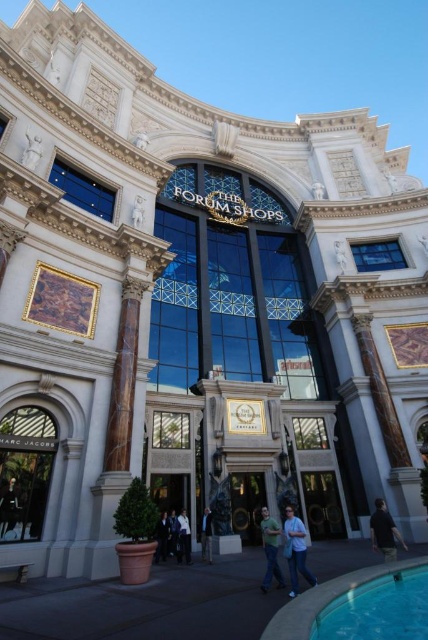
Does light blue denim jacket at center have a lesser height compared to dark blue jacket at center?

Incorrect, light blue denim jacket at center's height does not fall short of dark blue jacket at center's.

Can you confirm if light blue denim jacket at center is positioned below dark blue jacket at center?

Correct, light blue denim jacket at center is located below dark blue jacket at center.

Image resolution: width=428 pixels, height=640 pixels. Describe the element at coordinates (207, 536) in the screenshot. I see `light blue denim jacket at center` at that location.

The width and height of the screenshot is (428, 640). Find the location of `light blue denim jacket at center`. light blue denim jacket at center is located at coordinates (207, 536).

Is point (250, 499) in front of point (169, 516)?

No, it is behind (169, 516).

Between point (249, 476) and point (169, 525), which one is positioned behind?

Positioned behind is point (249, 476).

Is point (247, 484) positioned before point (169, 529)?

No, it is not.

The width and height of the screenshot is (428, 640). I want to click on wooden door at center, so click(x=246, y=504).

Is green matte shirt at lower center smaller than dark blue jacket at center?

Incorrect, green matte shirt at lower center is not smaller in size than dark blue jacket at center.

Is point (270, 557) farther from camera compared to point (175, 525)?

No, it is in front of (175, 525).

This screenshot has width=428, height=640. Identify the location of green matte shirt at lower center. click(x=270, y=548).